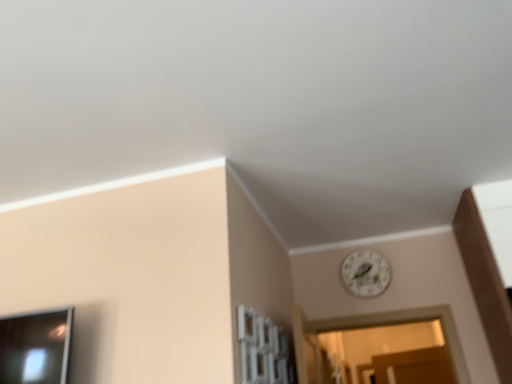
This screenshot has width=512, height=384. Describe the element at coordinates (365, 274) in the screenshot. I see `white floral clock at upper center` at that location.

At what (x,y) coordinates should I click in order to perform the action: click on white floral clock at upper center. Please return your answer as a coordinate pair (x, y). Looking at the image, I should click on (x=365, y=274).

Measure the distance between white floral clock at upper center and camera.

The depth of white floral clock at upper center is 9.48 feet.

You are a GUI agent. You are given a task and a screenshot of the screen. Output one action in this format:
    pyautogui.click(x=<x>, y=<y>)
    Task: Click on the white frosted glass window at center
    
    Given the screenshot: What is the action you would take?
    pyautogui.click(x=261, y=349)

Measure the distance between point (263, 351) and camera.

Point (263, 351) is 2.03 meters from camera.

Image resolution: width=512 pixels, height=384 pixels. What do you see at coordinates (261, 349) in the screenshot?
I see `white frosted glass window at center` at bounding box center [261, 349].

Locate an element on the screen. The height and width of the screenshot is (384, 512). white floral clock at upper center is located at coordinates (365, 274).

Based on the photo, considering the relative positions of white frosted glass window at center and white floral clock at upper center in the image provided, is white frosted glass window at center to the right of white floral clock at upper center from the viewer's perspective?

No.

Based on the photo, relative to white floral clock at upper center, is white frosted glass window at center in front or behind?

In the image, white frosted glass window at center appears in front of white floral clock at upper center.

Which is less distant, (263, 363) or (344, 261)?

Clearly, point (263, 363) is closer to the camera than point (344, 261).

From the image's perspective, which object appears higher, white frosted glass window at center or white floral clock at upper center?

white floral clock at upper center is shown above in the image.

From a real-world perspective, is white frosted glass window at center located beneath white floral clock at upper center?

Yes, from a real-world perspective, white frosted glass window at center is beneath white floral clock at upper center.

Between white frosted glass window at center and white floral clock at upper center, which one has smaller width?

white floral clock at upper center is thinner.

Does white frosted glass window at center have a lesser height compared to white floral clock at upper center?

Yes.

Does white frosted glass window at center have a smaller size compared to white floral clock at upper center?

No, white frosted glass window at center is not smaller than white floral clock at upper center.

Is white floral clock at upper center surrounded by white frosted glass window at center?

No, white frosted glass window at center does not contain white floral clock at upper center.

Is white frosted glass window at center far away from white floral clock at upper center?

white frosted glass window at center is far away from white floral clock at upper center.

Is white frosted glass window at center looking in the opposite direction of white floral clock at upper center?

No.

You are a GUI agent. You are given a task and a screenshot of the screen. Output one action in this format:
    pyautogui.click(x=<x>, y=<y>)
    Task: Click on the window in front of the white floral clock at upper center
    This screenshot has height=384, width=512.
    Given the screenshot: What is the action you would take?
    pyautogui.click(x=261, y=349)

Does white floral clock at upper center appear on the left side of white frosted glass window at center?

No.

Does white floral clock at upper center lie behind white frosted glass window at center?

Yes.

Which point is more distant from viewer, [340,274] or [256,354]?

Positioned behind is point [340,274].

From the image's perspective, is white floral clock at upper center on white frosted glass window at center?

Correct, white floral clock at upper center appears higher than white frosted glass window at center in the image.

From a real-world perspective, is white floral clock at upper center located higher than white frosted glass window at center?

Yes, from a real-world perspective, white floral clock at upper center is over white frosted glass window at center

Considering the relative sizes of white floral clock at upper center and white frosted glass window at center in the image provided, is white floral clock at upper center wider than white frosted glass window at center?

No, white floral clock at upper center is not wider than white frosted glass window at center.

Based on the photo, which of these two, white floral clock at upper center or white frosted glass window at center, stands shorter?

white frosted glass window at center.

Looking at the image, does white floral clock at upper center seem bigger or smaller compared to white frosted glass window at center?

white floral clock at upper center is smaller than white frosted glass window at center.

Can we say white floral clock at upper center lies outside white frosted glass window at center?

white floral clock at upper center lies outside white frosted glass window at center's area.

Can you see white floral clock at upper center touching white frosted glass window at center?

There is a gap between white floral clock at upper center and white frosted glass window at center.

Is white floral clock at upper center oriented towards white frosted glass window at center?

Yes, white floral clock at upper center is facing white frosted glass window at center.

In the scene shown: What's the angular difference between white floral clock at upper center and white frosted glass window at center's facing directions?

white floral clock at upper center and white frosted glass window at center are facing 90 degrees away from each other.

How much distance is there between white floral clock at upper center and white frosted glass window at center?

They are 1.07 meters apart.

Locate an element on the screen. This screenshot has width=512, height=384. window located below the white floral clock at upper center (from the image's perspective) is located at coordinates (261, 349).

Image resolution: width=512 pixels, height=384 pixels. What are the coordinates of `window lying below the white floral clock at upper center (from the image's perspective)` in the screenshot? It's located at (261, 349).

The width and height of the screenshot is (512, 384). I want to click on window located on the left of white floral clock at upper center, so pos(261,349).